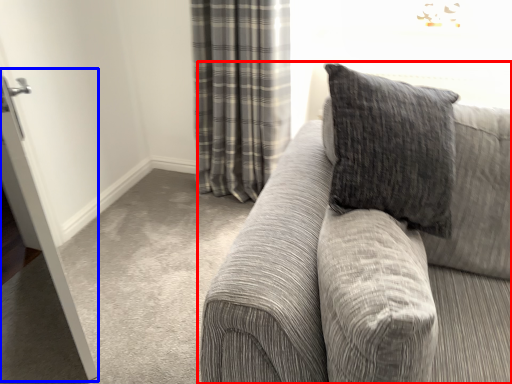
Question: Which object appears farthest to the camera in this image, studio couch (highlighted by a red box) or screen door (highlighted by a blue box)?

Choices:
 (A) studio couch
 (B) screen door

Answer: (B)